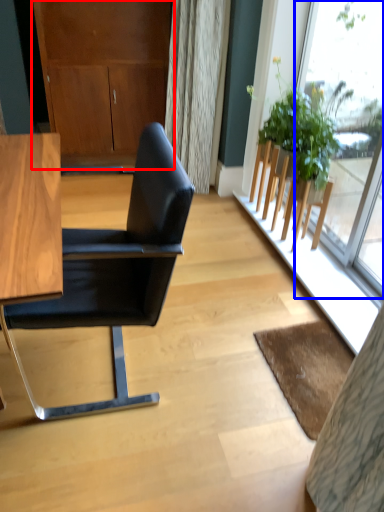
Question: Which object appears closest to the camera in this image, dresser (highlighted by a red box) or window (highlighted by a blue box)?

Choices:
 (A) dresser
 (B) window

Answer: (B)